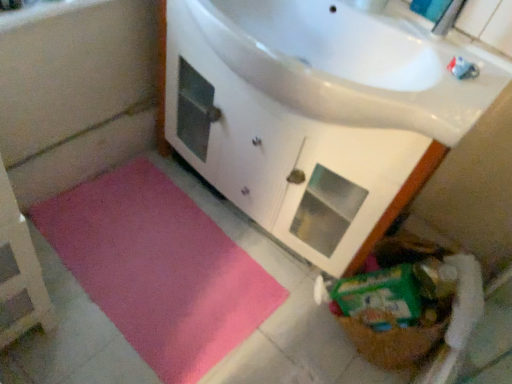
This screenshot has width=512, height=384. I want to click on free point above pink fabric bath mat at lower left (from a real-world perspective), so click(74, 134).